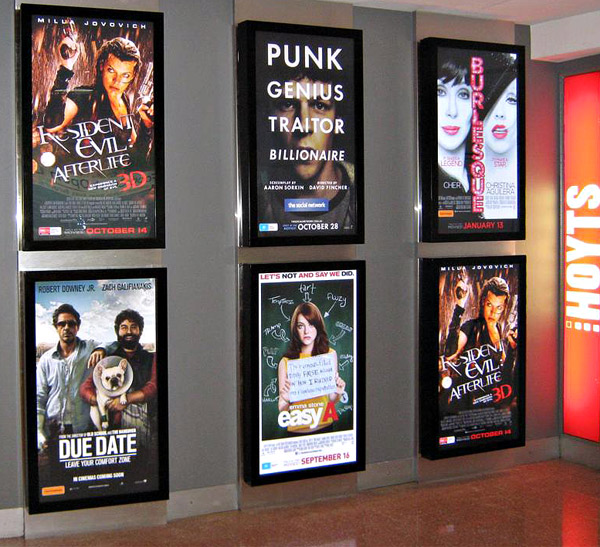
The width and height of the screenshot is (600, 547). I want to click on brown floor, so coord(546,510).